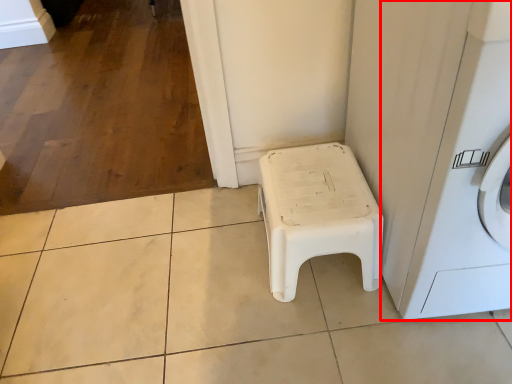
Question: From the image's perspective, what is the correct spatial positioning of washing machine (annotated by the red box) in reference to furniture?

Choices:
 (A) above
 (B) below

Answer: (A)